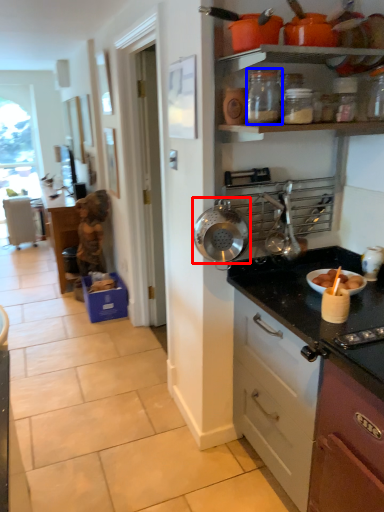
Question: Which of the following is the closest to the observer, kitchen appliance (highlighted by a red box) or kitchen appliance (highlighted by a blue box)?

Choices:
 (A) kitchen appliance
 (B) kitchen appliance

Answer: (B)